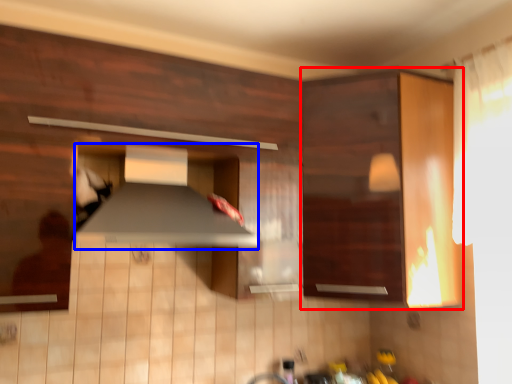
Question: Which point is closer to the camera, cabinetry (highlighted by a red box) or exhaust hood (highlighted by a blue box)?

Choices:
 (A) cabinetry
 (B) exhaust hood

Answer: (B)